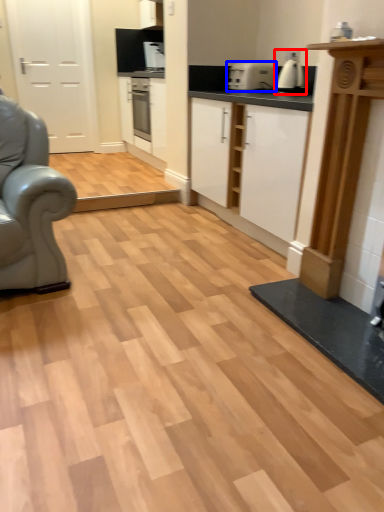
Question: Which point is further to the camera, coffee machine (highlighted by a red box) or appliance (highlighted by a blue box)?

Choices:
 (A) coffee machine
 (B) appliance

Answer: (B)